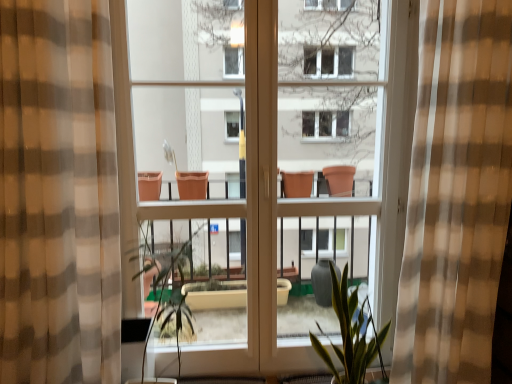
Question: Would you say green leafy plant at center is a long distance from checkered fabric curtain at center, which is the 1th curtain in right-to-left order?

Choices:
 (A) no
 (B) yes

Answer: (B)

Question: From a real-world perspective, is green leafy plant at center below checkered fabric curtain at center, which is the 2th curtain from left to right?

Choices:
 (A) yes
 (B) no

Answer: (A)

Question: Can you confirm if green leafy plant at center is bigger than checkered fabric curtain at center, which is the 2th curtain from left to right?

Choices:
 (A) yes
 (B) no

Answer: (B)

Question: Considering the relative sizes of green leafy plant at center and checkered fabric curtain at center, which is the 1th curtain in right-to-left order, in the image provided, is green leafy plant at center thinner than checkered fabric curtain at center, which is the 1th curtain in right-to-left order,?

Choices:
 (A) no
 (B) yes

Answer: (A)

Question: Considering the relative sizes of green leafy plant at center and checkered fabric curtain at center, which is the 2th curtain from left to right, in the image provided, is green leafy plant at center taller than checkered fabric curtain at center, which is the 2th curtain from left to right,?

Choices:
 (A) yes
 (B) no

Answer: (B)

Question: Is green matte plant at center taller or shorter than checkered fabric curtain at center, which is the 2th curtain from left to right?

Choices:
 (A) tall
 (B) short

Answer: (B)

Question: From the image's perspective, relative to checkered fabric curtain at center, which is the 2th curtain from left to right, is green matte plant at center above or below?

Choices:
 (A) above
 (B) below

Answer: (B)

Question: Relative to checkered fabric curtain at center, which is the 1th curtain in right-to-left order, is green matte plant at center in front or behind?

Choices:
 (A) behind
 (B) front

Answer: (A)

Question: Considering the positions of point (346, 339) and point (430, 39), is point (346, 339) closer or farther from the camera than point (430, 39)?

Choices:
 (A) farther
 (B) closer

Answer: (A)

Question: From a real-world perspective, relative to checkered fabric curtain at center, which is the 1th curtain in right-to-left order, is brown checkered curtain at left, arranged as the second curtain when viewed from the right, vertically above or below?

Choices:
 (A) below
 (B) above

Answer: (B)

Question: Considering their positions, is brown checkered curtain at left, the 1th curtain when ordered from left to right, located in front of or behind checkered fabric curtain at center, which is the 2th curtain from left to right?

Choices:
 (A) front
 (B) behind

Answer: (A)

Question: Looking at the image, does brown checkered curtain at left, arranged as the second curtain when viewed from the right, seem bigger or smaller compared to checkered fabric curtain at center, which is the 2th curtain from left to right?

Choices:
 (A) big
 (B) small

Answer: (B)

Question: Is point (93, 322) positioned closer to the camera than point (426, 66)?

Choices:
 (A) closer
 (B) farther

Answer: (B)

Question: Relative to brown checkered curtain at left, the 1th curtain when ordered from left to right, is green leafy plant at center in front or behind?

Choices:
 (A) front
 (B) behind

Answer: (B)

Question: Which is correct: green leafy plant at center is inside brown checkered curtain at left, the 1th curtain when ordered from left to right, or outside of it?

Choices:
 (A) inside
 (B) outside

Answer: (B)